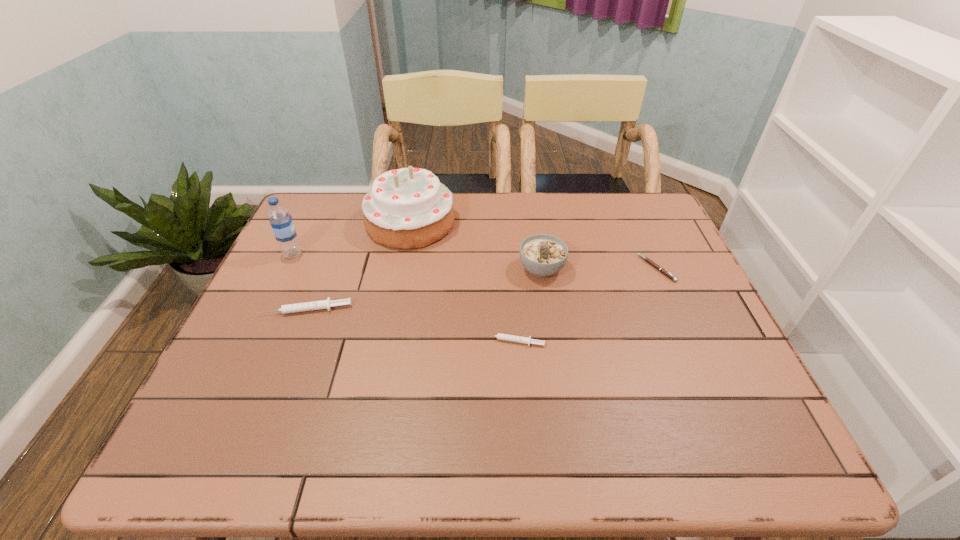
Find the location of `vacant point located 0.210m on the back of the second shortest object`. vacant point located 0.210m on the back of the second shortest object is located at coordinates (508, 275).

Identify the location of vacant point located 0.290m on the front of the cake. (390, 329).

Locate an element on the screen. vacant position located 0.210m on the label of the water bottle is located at coordinates (377, 254).

You are a GUI agent. You are given a task and a screenshot of the screen. Output one action in this format:
    pyautogui.click(x=<x>, y=<y>)
    Task: Click on the free point located 0.050m on the right of the soup bowl
    
    Given the screenshot: What is the action you would take?
    pyautogui.click(x=584, y=269)

Where is `vacant space located 0.360m at the nib of the shortest object`? vacant space located 0.360m at the nib of the shortest object is located at coordinates (511, 268).

Locate an element on the screen. vacant space located at the nib of the shortest object is located at coordinates (551, 268).

Locate an element on the screen. Image resolution: width=960 pixels, height=540 pixels. vacant space located 0.330m at the nib of the shortest object is located at coordinates (521, 268).

Find the location of a particular element. The width and height of the screenshot is (960, 540). object at the far edge is located at coordinates (408, 208).

The image size is (960, 540). What are the coordinates of `syringe that is at the left edge` in the screenshot? It's located at pyautogui.click(x=323, y=304).

What are the coordinates of `water bottle positioned at the left edge` in the screenshot? It's located at [281, 221].